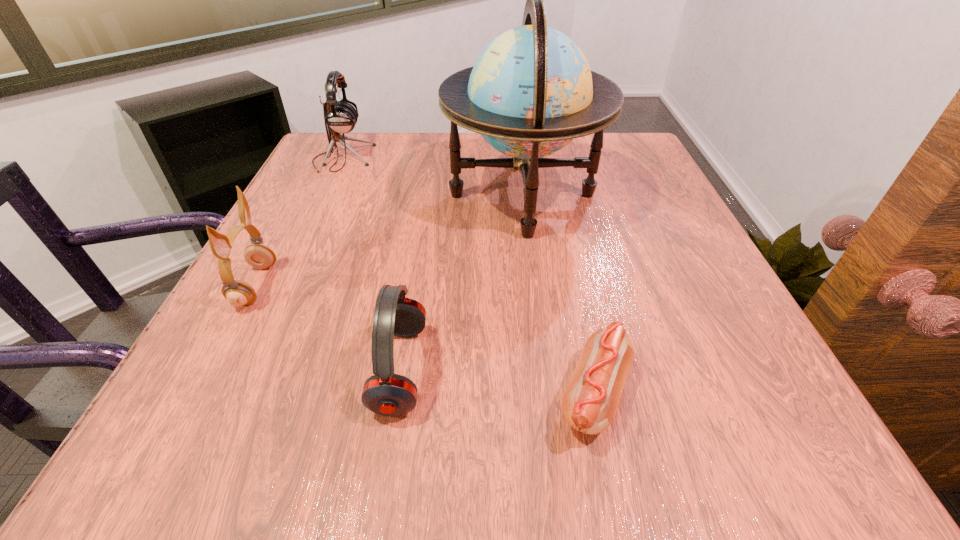
Identify the location of globe. (531, 91).

Image resolution: width=960 pixels, height=540 pixels. What are the coordinates of `the second tallest object` in the screenshot? It's located at (340, 116).

Where is `the farthest earphone`? the farthest earphone is located at coordinates (340, 116).

Where is `the third nearest object`? the third nearest object is located at coordinates click(x=238, y=293).

At what (x,y) coordinates should I click in order to perform the action: click on the second farthest earphone. Please return your answer as a coordinate pair (x, y). Looking at the image, I should click on (238, 293).

This screenshot has width=960, height=540. What are the coordinates of `the third object from left to right` in the screenshot? It's located at [385, 393].

This screenshot has width=960, height=540. In order to click on the nearest earphone in this screenshot , I will do `click(385, 393)`.

Where is `sausage`? This screenshot has height=540, width=960. sausage is located at coordinates (589, 404).

Identify the location of vacant region located 0.200m on the surface of the tallest object. The height and width of the screenshot is (540, 960). (352, 195).

The width and height of the screenshot is (960, 540). Identify the location of vacant area located 0.170m on the surface of the tallest object. (367, 195).